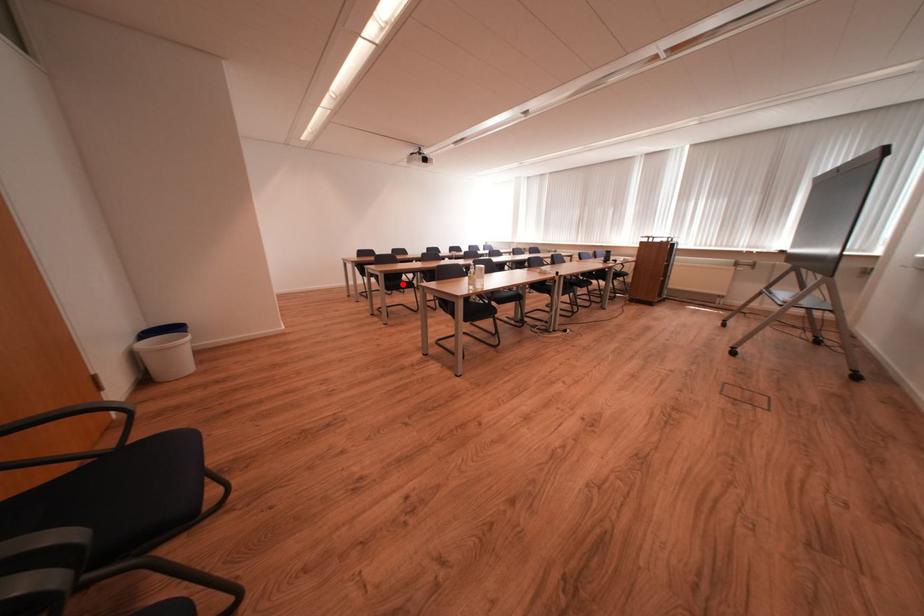
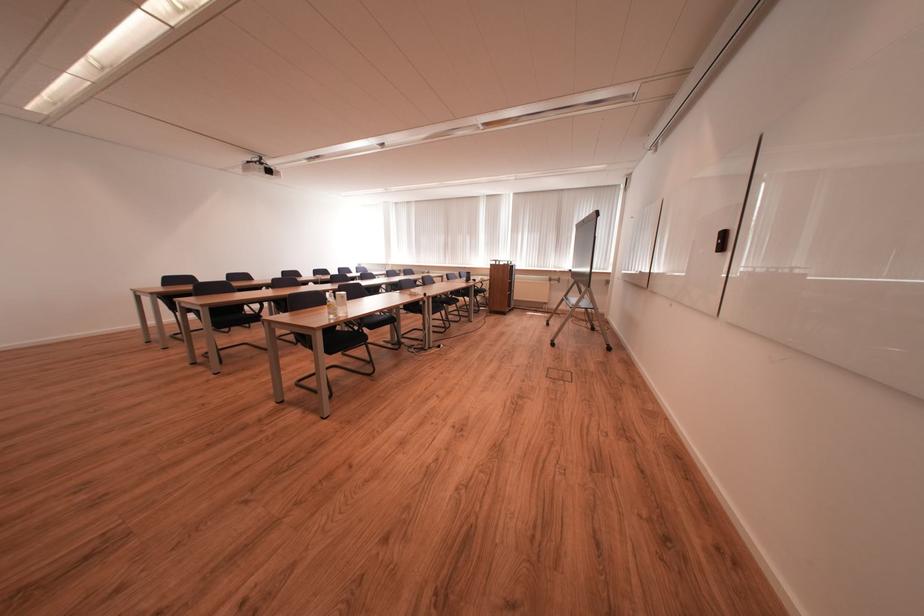
In the second image, find the point that corresponds to the highlighted location in the first image.

(237, 318)